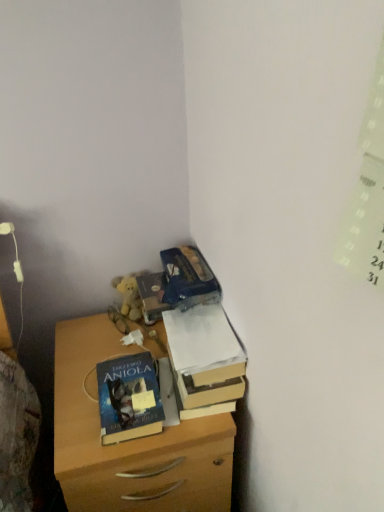
I want to click on vacant area that is in front of blue matte book at center, so click(112, 451).